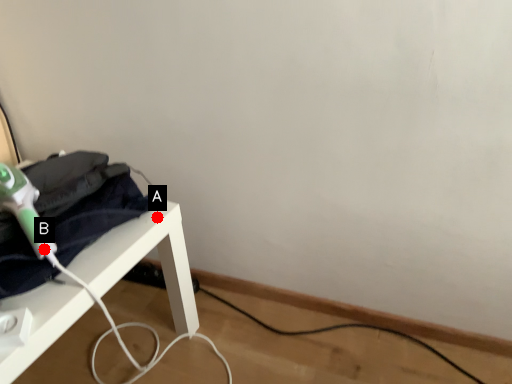
Question: Two points are circled on the image, labeled by A and B beside each circle. Which point is closer to the camera taking this photo?

Choices:
 (A) A is closer
 (B) B is closer

Answer: (B)